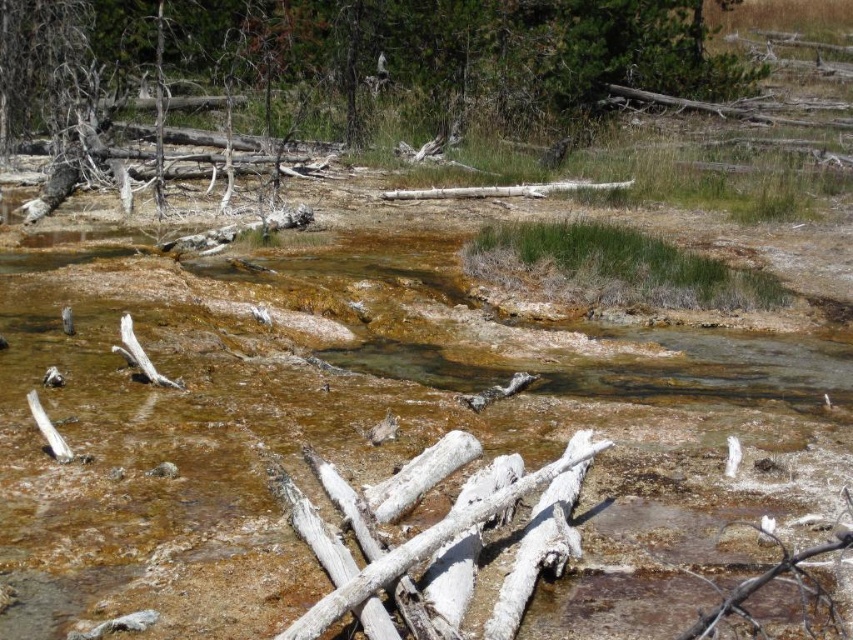
Does brown sedimentary stream at center have a lesser width compared to dead wood log at upper center?

Correct, brown sedimentary stream at center's width is less than dead wood log at upper center's.

Is point (50, 534) positioned in front of point (473, 22)?

Yes, point (50, 534) is in front of point (473, 22).

What do you see at coordinates (376, 435) in the screenshot? I see `brown sedimentary stream at center` at bounding box center [376, 435].

Identify the location of brown sedimentary stream at center. Image resolution: width=853 pixels, height=640 pixels. (376, 435).

Is point (0, 102) closer to camera compared to point (583, 456)?

No, (0, 102) is behind (583, 456).

The image size is (853, 640). I want to click on dead wood log at upper center, so click(x=386, y=51).

Between brown sedimentary stream at center and white frosty log at center, which one appears on the left side from the viewer's perspective?

From the viewer's perspective, white frosty log at center appears more on the left side.

Between brown sedimentary stream at center and white frosty log at center, which one is positioned higher?

brown sedimentary stream at center

Does point (474, 384) come behind point (283, 632)?

Yes, point (474, 384) is farther from viewer.

Identify the location of brown sedimentary stream at center. This screenshot has width=853, height=640. (376, 435).